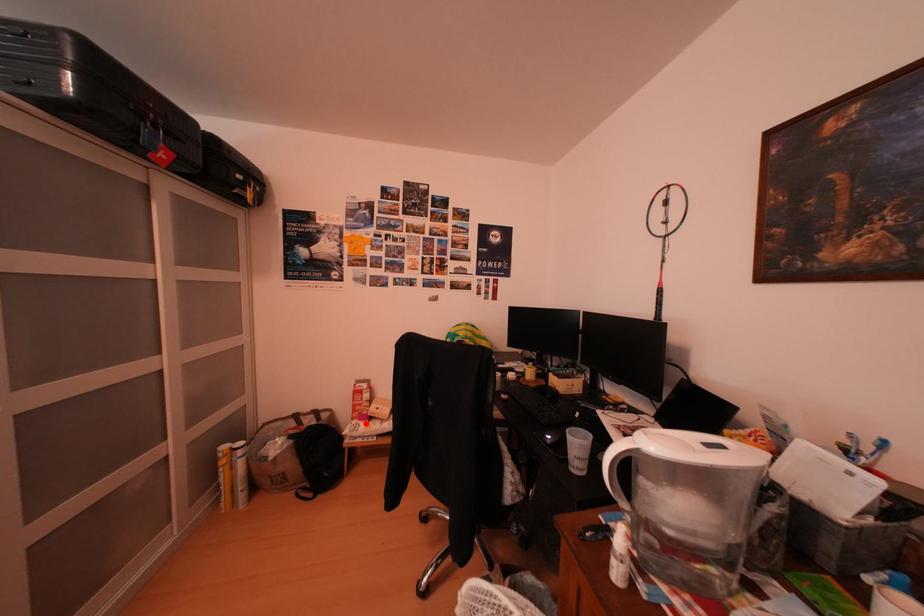
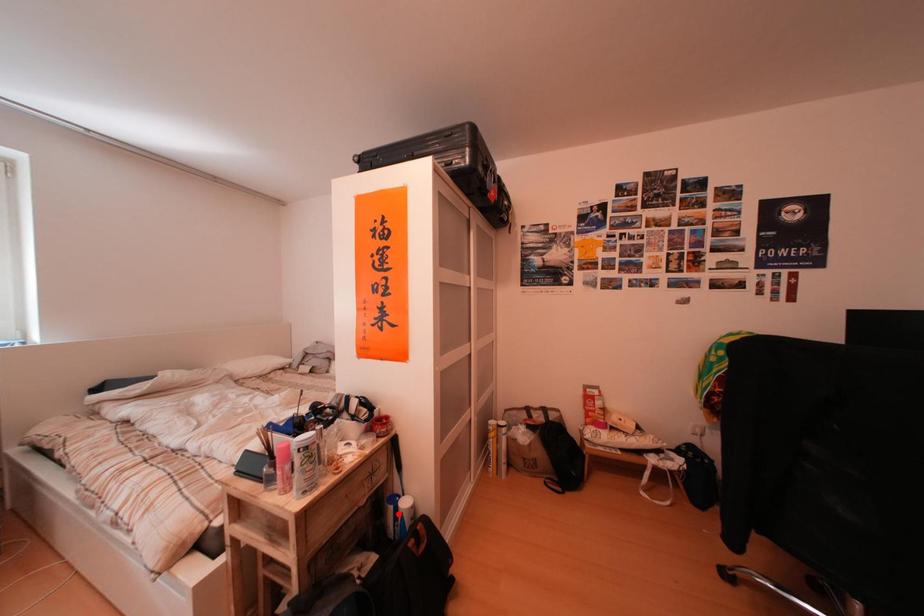
I am providing you with two images of the same scene from different viewpoints. A red point is marked on the first image and another point is marked on the second image. Is the red point in image1 aligned with the point shown in image2?

No